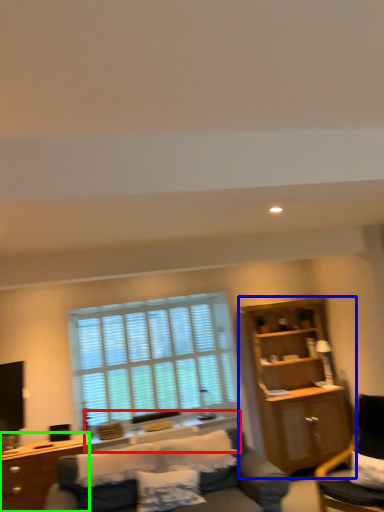
Question: Which object is the farthest from side table (highlighted by a red box)? Choose among these: cabinetry (highlighted by a blue box) or desk (highlighted by a green box).

Choices:
 (A) cabinetry
 (B) desk

Answer: (A)